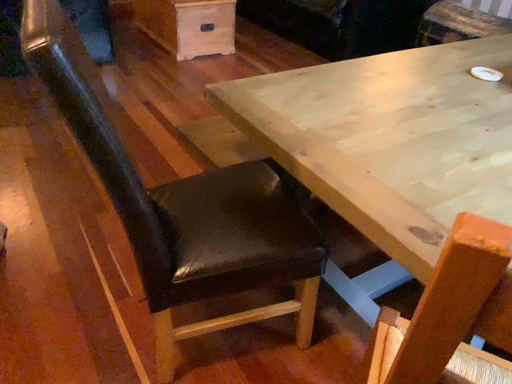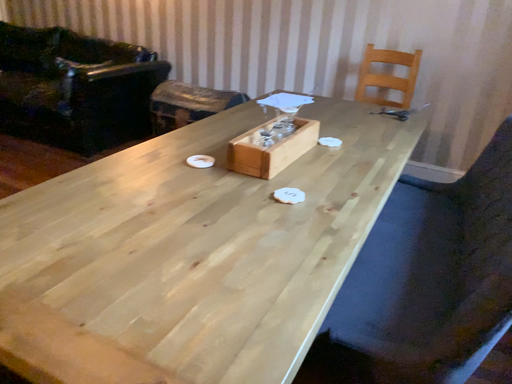
Question: Which way did the camera rotate in the video?

Choices:
 (A) rotated right
 (B) rotated left

Answer: (A)